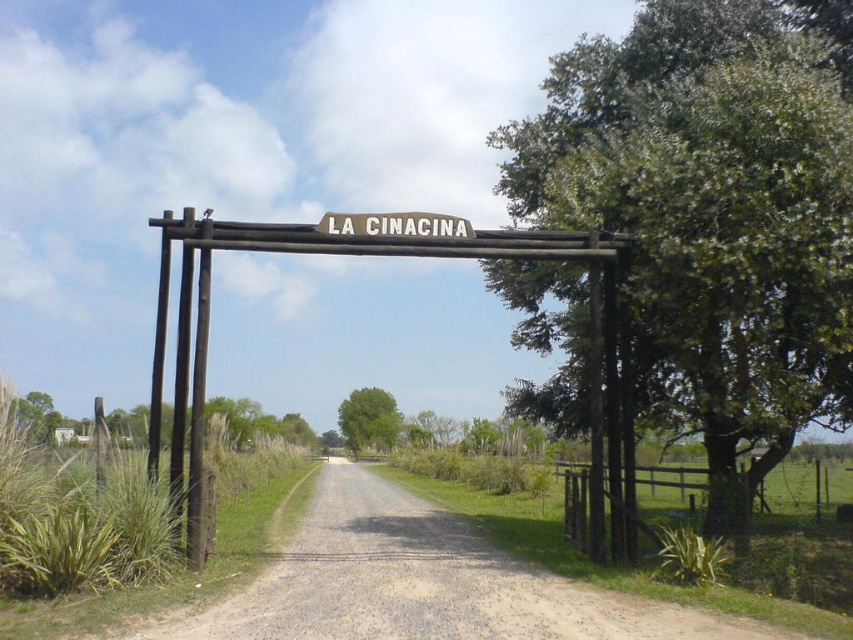
You are driving a car that is 5 meters long. You need to pass through the entrance gate shown in the image. Can your car fit through the space between the brown gravel dirt track at center and the white wooden sign at center?

The distance between the brown gravel dirt track at center and the white wooden sign at center is 5.81 meters. Since the car is 5 meters long, it can fit through the space as there is enough length to accommodate it.

You are standing at the entrance of LA CINACINA gate and want to take a photo of the green leafy tree at right. Where should you position yourself to capture the tree in the frame?

The green leafy tree at right is located at coordinates 0.328 on the x axis and 0.836 on the y axis, so you should position yourself to aim your camera towards that coordinate to capture the tree in the frame.